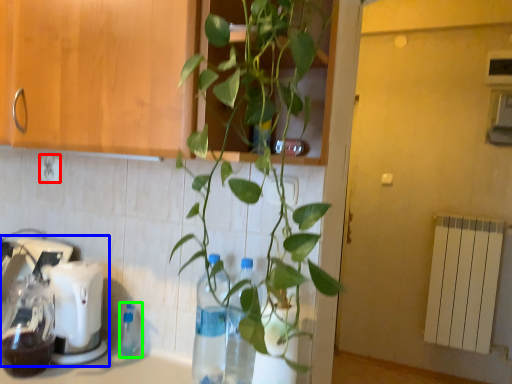
Question: Which is farther away from electric outlet (highlighted by a red box)? mixer (highlighted by a blue box) or bottle (highlighted by a green box)?

Choices:
 (A) mixer
 (B) bottle

Answer: (B)